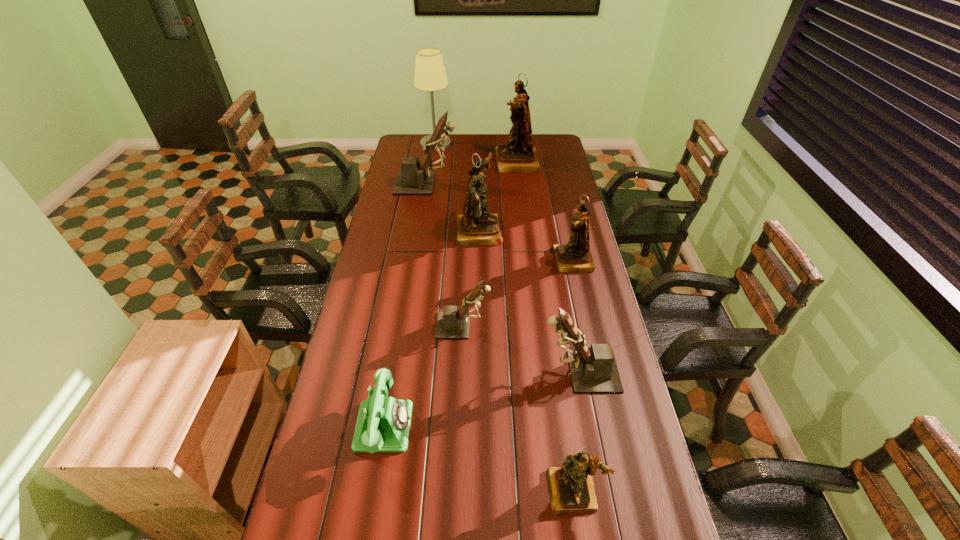
Where is `table lamp`? table lamp is located at coordinates (430, 75).

Find the location of a particular element. The width and height of the screenshot is (960, 540). the biggest gold figurine is located at coordinates (518, 155).

Locate an element on the screen. the farthest gold figurine is located at coordinates (518, 155).

Find the location of `the biggest brown figurine`. the biggest brown figurine is located at coordinates (413, 179).

Locate an element on the screen. the second farthest gold figurine is located at coordinates (476, 226).

The width and height of the screenshot is (960, 540). Find the location of `the third farthest figurine`. the third farthest figurine is located at coordinates (476, 226).

I want to click on the fifth nearest object, so click(575, 256).

The image size is (960, 540). Identify the location of the third farthest gold figurine. [x=575, y=256].

Find the location of a particular element. the nearest brown figurine is located at coordinates (593, 370).

Locate an element on the screen. The width and height of the screenshot is (960, 540). the second smallest brown figurine is located at coordinates (593, 370).